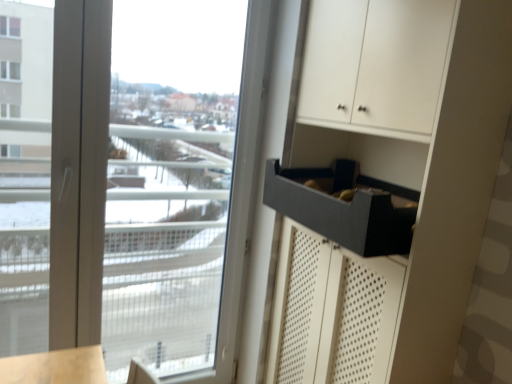
Question: Does transparent glass window at upper left have a greater height compared to matte gray drawer at lower right?

Choices:
 (A) no
 (B) yes

Answer: (B)

Question: Is transparent glass window at upper left touching matte gray drawer at lower right?

Choices:
 (A) no
 (B) yes

Answer: (A)

Question: From the image's perspective, is transparent glass window at upper left above matte gray drawer at lower right?

Choices:
 (A) yes
 (B) no

Answer: (B)

Question: Is transparent glass window at upper left to the left of matte gray drawer at lower right from the viewer's perspective?

Choices:
 (A) yes
 (B) no

Answer: (A)

Question: From a real-world perspective, is transparent glass window at upper left under matte gray drawer at lower right?

Choices:
 (A) no
 (B) yes

Answer: (B)

Question: Is transparent glass window at upper left closer to the viewer compared to matte gray drawer at lower right?

Choices:
 (A) no
 (B) yes

Answer: (A)

Question: Is matte gray drawer at lower right surrounding matte black drawer at right?

Choices:
 (A) no
 (B) yes

Answer: (A)

Question: Does matte gray drawer at lower right have a lesser width compared to matte black drawer at right?

Choices:
 (A) no
 (B) yes

Answer: (A)

Question: Is matte gray drawer at lower right at the right side of matte black drawer at right?

Choices:
 (A) yes
 (B) no

Answer: (B)

Question: Would you say matte gray drawer at lower right is outside matte black drawer at right?

Choices:
 (A) no
 (B) yes

Answer: (A)

Question: Is matte gray drawer at lower right aimed at matte black drawer at right?

Choices:
 (A) yes
 (B) no

Answer: (A)

Question: Are matte gray drawer at lower right and matte black drawer at right making contact?

Choices:
 (A) yes
 (B) no

Answer: (B)

Question: Can you confirm if transparent glass window at upper left is wider than matte black drawer at right?

Choices:
 (A) yes
 (B) no

Answer: (B)